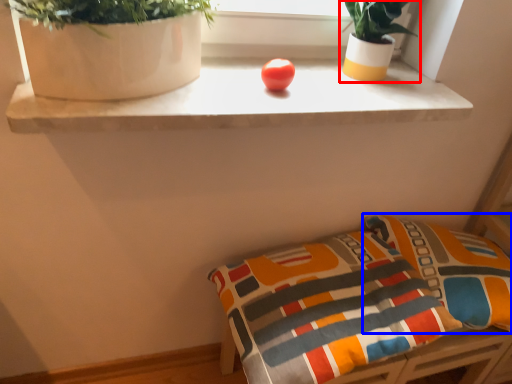
Question: Which point is closer to the camera, houseplant (highlighted by a red box) or pillow (highlighted by a blue box)?

Choices:
 (A) houseplant
 (B) pillow

Answer: (A)